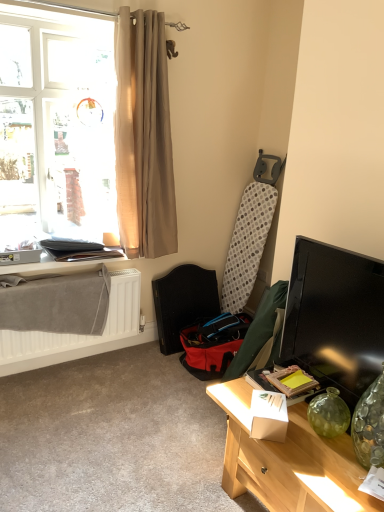
You are a GUI agent. You are given a task and a screenshot of the screen. Output one action in this format:
    pyautogui.click(x=<x>, y=<y>)
    Task: Click on the free point above white matte radiator at lower left (from a real-world perspective)
    The image size is (384, 512).
    Given the screenshot: What is the action you would take?
    pyautogui.click(x=91, y=269)